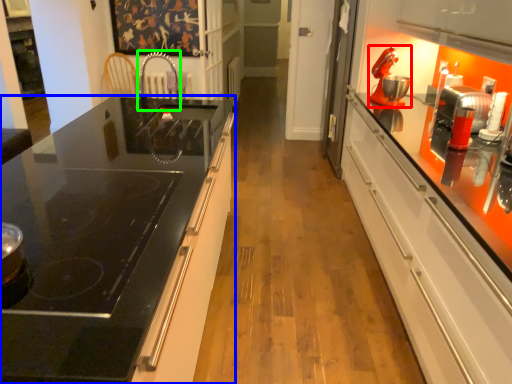
Question: Based on their relative distances, which object is nearer to home appliance (highlighted by a red box)? Choose from countertop (highlighted by a blue box) and faucet (highlighted by a green box).

Choices:
 (A) countertop
 (B) faucet

Answer: (A)